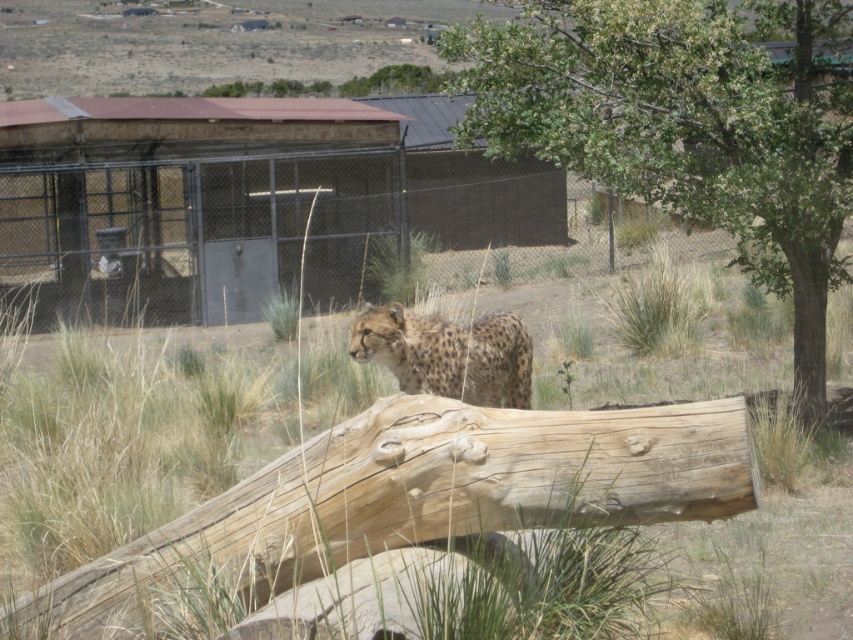
Between point (552, 8) and point (514, 358), which one is positioned in front?

Positioned in front is point (514, 358).

Who is more distant from viewer, (x=514, y=113) or (x=505, y=371)?

Positioned behind is point (x=514, y=113).

Identify the location of green leafy tree at upper right. The height and width of the screenshot is (640, 853). (689, 125).

Based on the photo, how distant is green grass at center from green leafy tree at upper right?

A distance of 15.06 feet exists between green grass at center and green leafy tree at upper right.

Can you confirm if green grass at center is taller than green leafy tree at upper right?

Indeed, green grass at center has a greater height compared to green leafy tree at upper right.

At what (x,y) coordinates should I click in order to perform the action: click on green grass at center. Please return your answer as a coordinate pair (x, y). Looking at the image, I should click on (140, 426).

Is green grass at center below spotted fur cheetah at center?

Yes, green grass at center is below spotted fur cheetah at center.

Can you confirm if green grass at center is wider than spotted fur cheetah at center?

Correct, the width of green grass at center exceeds that of spotted fur cheetah at center.

Between point (848, 376) and point (461, 397), which one is positioned in front?

Point (461, 397) is in front.

Where is `green grass at center`? Image resolution: width=853 pixels, height=640 pixels. green grass at center is located at coordinates (140, 426).